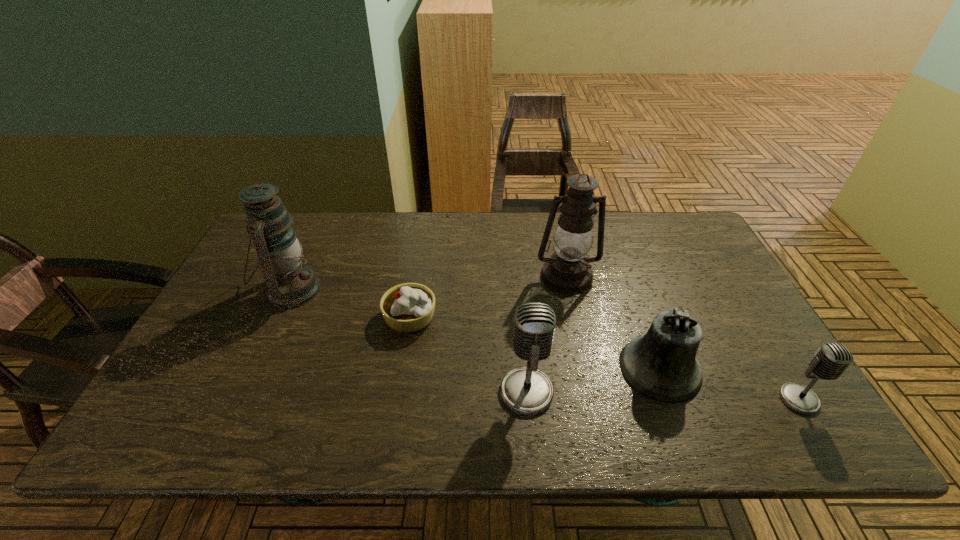
The width and height of the screenshot is (960, 540). What are the coordinates of `free space that satisfies the following two spatial constraints: 1. on the front side of the bell; 2. on the right side of the right oil lamp` in the screenshot? It's located at (587, 368).